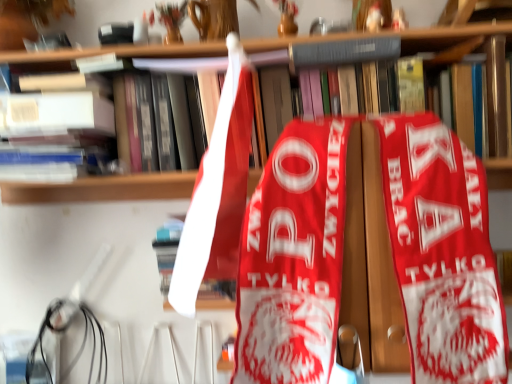
Question: Does point (44, 362) appear closer or farther from the camera than point (307, 56)?

Choices:
 (A) closer
 (B) farther

Answer: (B)

Question: Looking at the image, does black rubber wire at lower left seem bigger or smaller compared to hardcover book at upper center, which ranks as the second book in bottom-to-top order?

Choices:
 (A) small
 (B) big

Answer: (B)

Question: Considering the real-world distances, which object is closest to the hardcover book at upper center, the second book from the left?

Choices:
 (A) matte white book at upper left, which is the 1th book from left to right
 (B) wooden bookcase at center
 (C) black rubber wire at lower left

Answer: (B)

Question: Which object is positioned closest to the black rubber wire at lower left?

Choices:
 (A) matte white book at upper left, which is the second book from right to left
 (B) wooden bookcase at center
 (C) hardcover book at upper center, the second book from the left

Answer: (A)